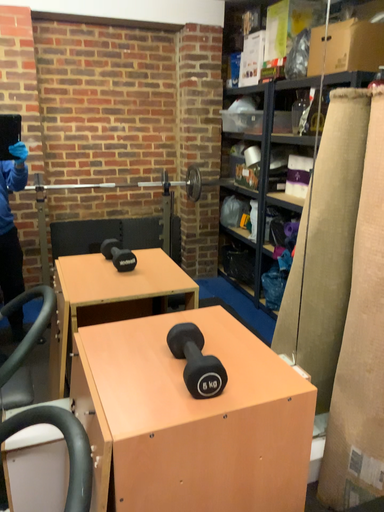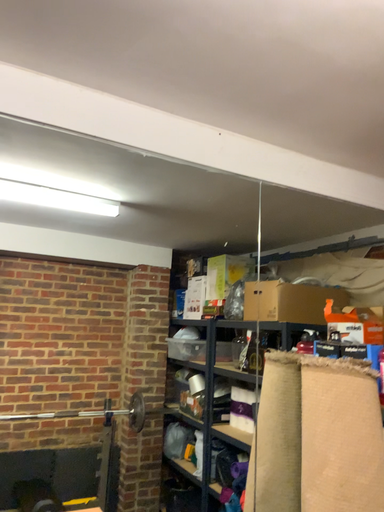
Question: How did the camera likely rotate when shooting the video?

Choices:
 (A) rotated right
 (B) rotated left

Answer: (A)